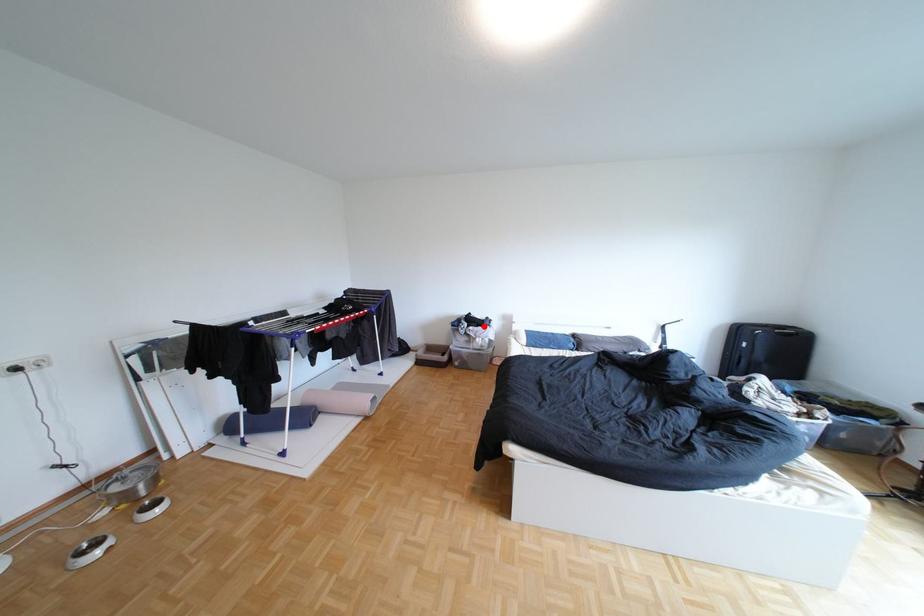
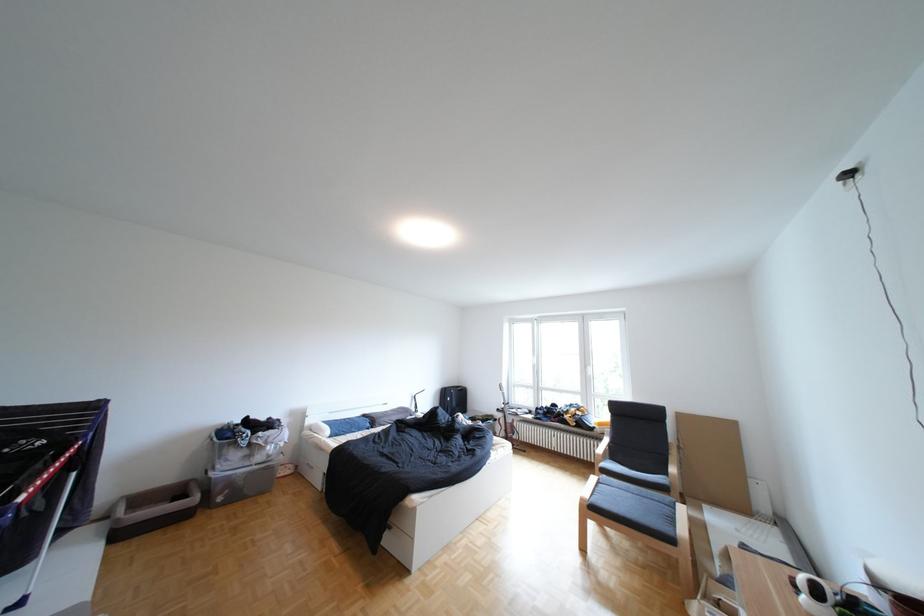
Find the pixel in the second image that matches the highlighted location in the first image.

(270, 434)